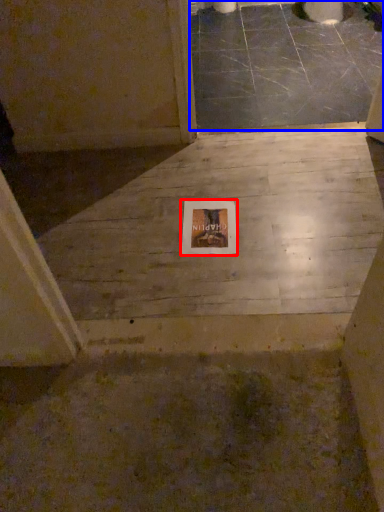
Question: Which object appears farthest to the camera in this image, picture frame (highlighted by a red box) or concrete (highlighted by a blue box)?

Choices:
 (A) picture frame
 (B) concrete

Answer: (B)